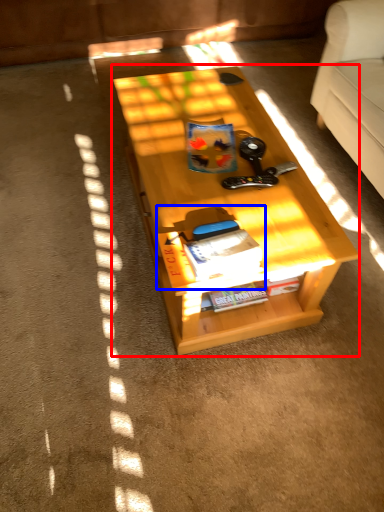
Question: Which of the following is the farthest to the observer, table (highlighted by a red box) or book (highlighted by a blue box)?

Choices:
 (A) table
 (B) book

Answer: (A)